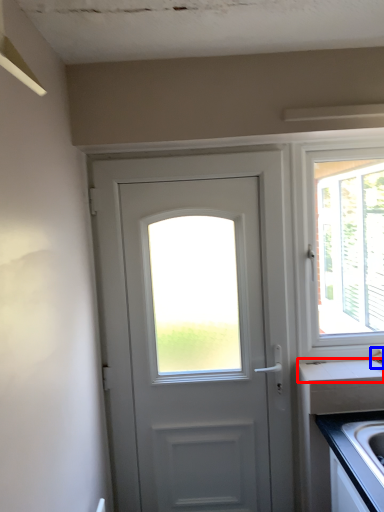
Question: Which object appears closest to the camera in this image, counter top (highlighted by a red box) or faucet (highlighted by a blue box)?

Choices:
 (A) counter top
 (B) faucet

Answer: (B)